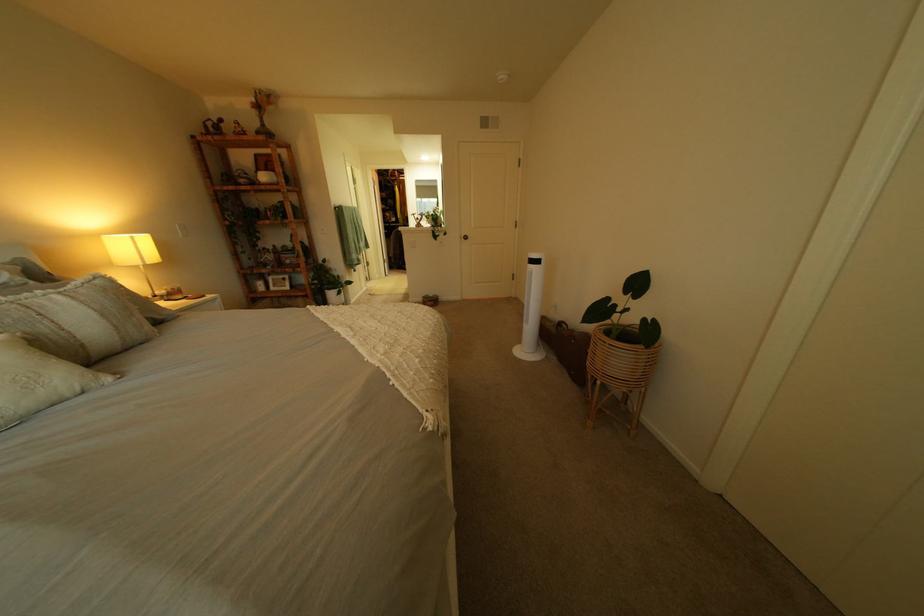
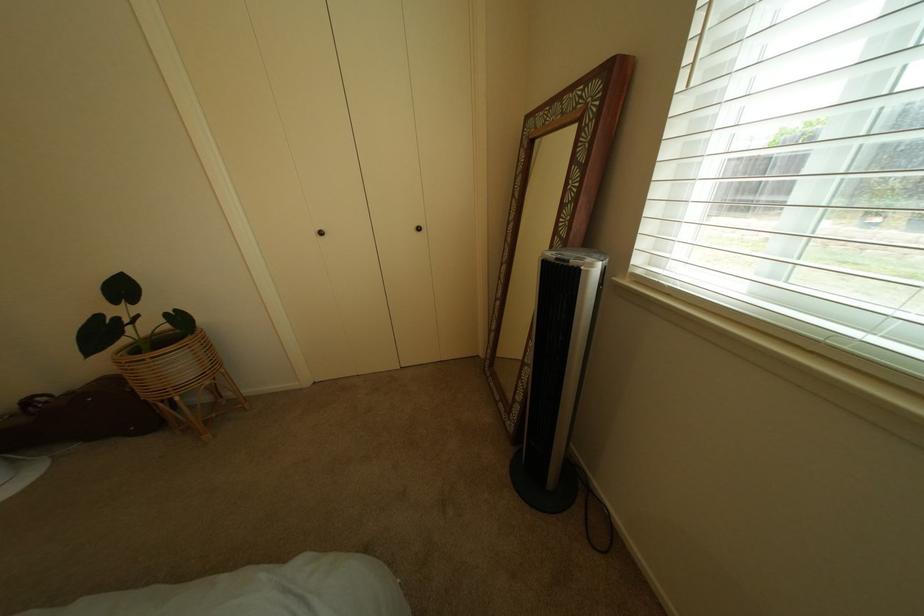
Find the pixel in the second image that matches pixel 626 346 in the first image.

(167, 359)